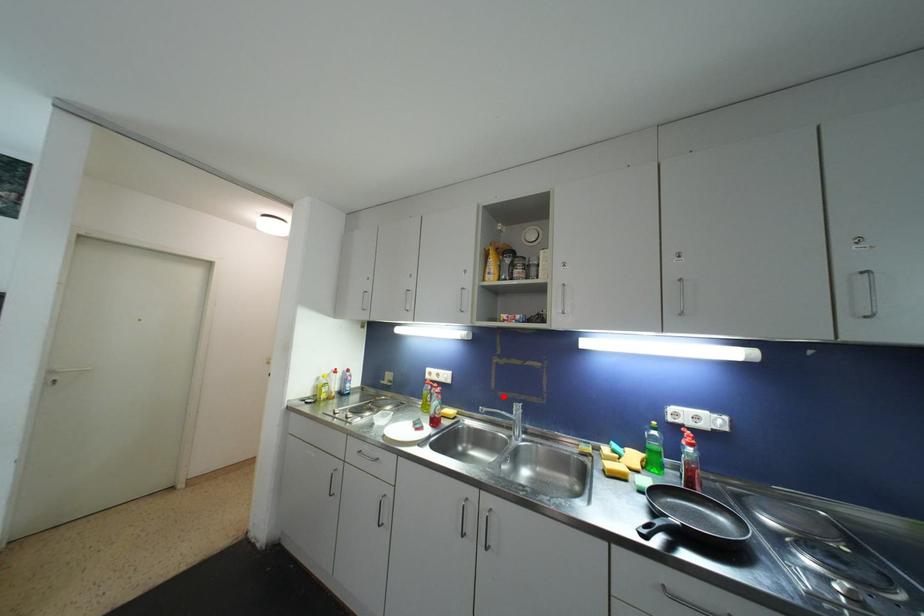
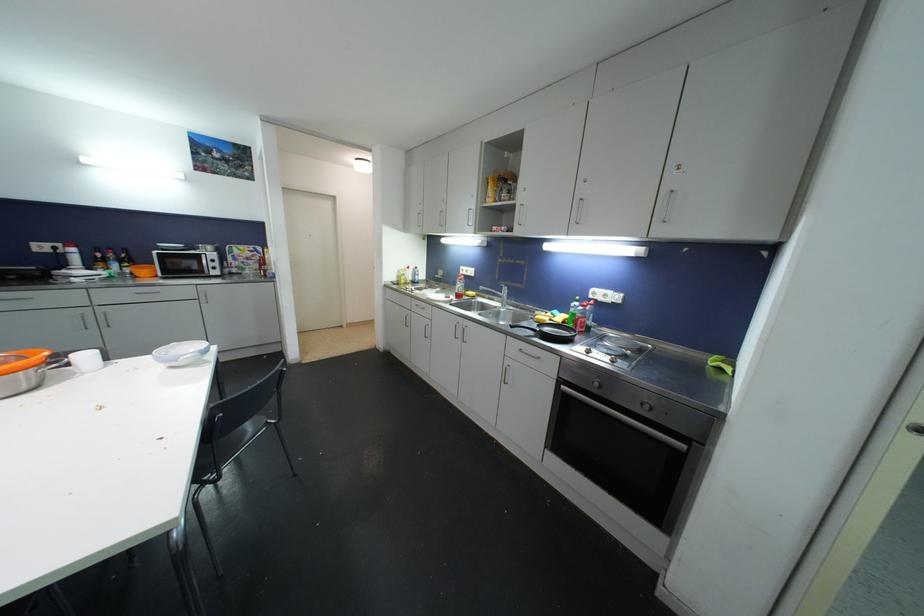
Question: I am providing you with two images of the same scene from different viewpoints. Given a red point in image1, look at the same physical point in image2. Is it:

Choices:
 (A) Closer to the viewpoint
 (B) Farther from the viewpoint

Answer: (A)